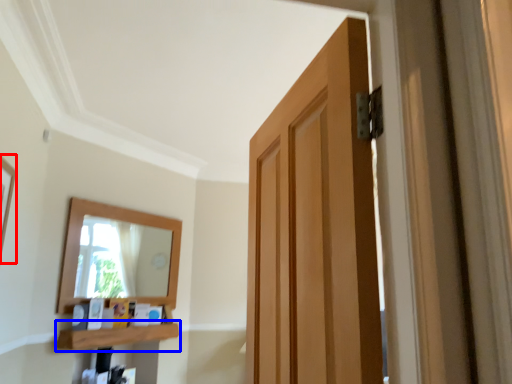
Question: Among these objects, which one is nearest to the camera, picture frame (highlighted by a red box) or shelf (highlighted by a blue box)?

Choices:
 (A) picture frame
 (B) shelf

Answer: (A)